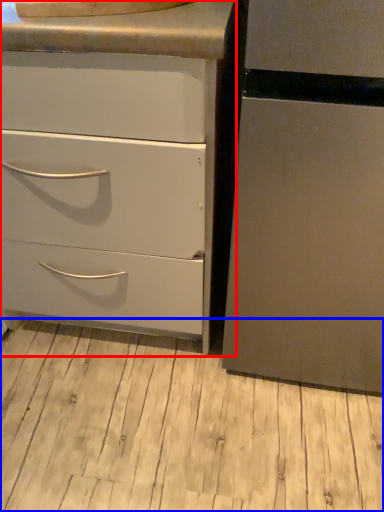
Question: Which point is closer to the camera, chest of drawers (highlighted by a red box) or plank (highlighted by a blue box)?

Choices:
 (A) chest of drawers
 (B) plank

Answer: (A)